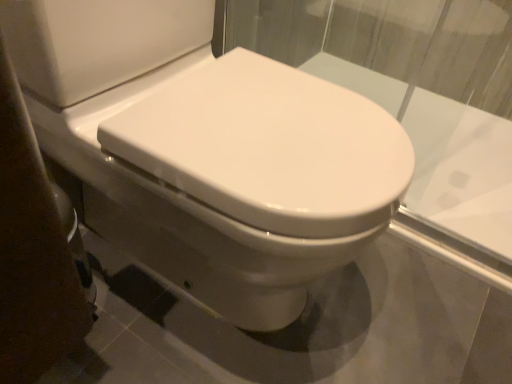
Find the location of a particular element. Image resolution: width=512 pixels, height=384 pixels. transparent glass at center is located at coordinates (413, 89).

Describe the element at coordinates (413, 89) in the screenshot. The width and height of the screenshot is (512, 384). I see `transparent glass at center` at that location.

The width and height of the screenshot is (512, 384). What do you see at coordinates (269, 155) in the screenshot? I see `white glossy bidet at center` at bounding box center [269, 155].

Find the location of a particular element. The image size is (512, 384). white glossy bidet at center is located at coordinates (269, 155).

At what (x,y) coordinates should I click in order to perform the action: click on transparent glass at center. Please return your answer as a coordinate pair (x, y). The width and height of the screenshot is (512, 384). Looking at the image, I should click on click(x=413, y=89).

Is transparent glass at center at the left side of white glossy bidet at center?

No, transparent glass at center is not to the left of white glossy bidet at center.

Considering the relative positions of transparent glass at center and white glossy bidet at center in the image provided, is transparent glass at center in front of white glossy bidet at center?

No, transparent glass at center is further to the viewer.

Does point (409, 21) lie behind point (220, 88)?

Yes, it is behind point (220, 88).

From the image's perspective, is transparent glass at center on white glossy bidet at center?

Indeed, from the image's perspective, transparent glass at center is shown above white glossy bidet at center.

From a real-world perspective, who is located higher, transparent glass at center or white glossy bidet at center?

From a 3D spatial view, white glossy bidet at center is above.

Looking at their sizes, would you say transparent glass at center is wider or thinner than white glossy bidet at center?

Considering their sizes, transparent glass at center looks slimmer than white glossy bidet at center.

Can you confirm if transparent glass at center is shorter than white glossy bidet at center?

Yes, transparent glass at center is shorter than white glossy bidet at center.

In terms of size, does transparent glass at center appear bigger or smaller than white glossy bidet at center?

Clearly, transparent glass at center is smaller in size than white glossy bidet at center.

Which is correct: transparent glass at center is inside white glossy bidet at center, or outside of it?

transparent glass at center can be found inside white glossy bidet at center.

Is transparent glass at center placed right next to white glossy bidet at center?

No.

Could you tell me if transparent glass at center is facing white glossy bidet at center?

Yes.

What's the angular difference between transparent glass at center and white glossy bidet at center's facing directions?

91 degrees.

I want to click on bidet in front of the transparent glass at center, so click(269, 155).

Can you confirm if white glossy bidet at center is positioned to the right of transparent glass at center?

Incorrect, white glossy bidet at center is not on the right side of transparent glass at center.

Between white glossy bidet at center and transparent glass at center, which one is positioned in front?

white glossy bidet at center is more forward.

Is point (328, 104) positioned behind point (500, 79)?

No, (328, 104) is closer to viewer.

From the image's perspective, between white glossy bidet at center and transparent glass at center, which one is located above?

From the image's view, transparent glass at center is above.

From a real-world perspective, is white glossy bidet at center beneath transparent glass at center?

Actually, white glossy bidet at center is physically above transparent glass at center in the real world.

In terms of width, does white glossy bidet at center look wider or thinner when compared to transparent glass at center?

Considering their sizes, white glossy bidet at center looks broader than transparent glass at center.

Considering the relative sizes of white glossy bidet at center and transparent glass at center in the image provided, is white glossy bidet at center shorter than transparent glass at center?

No.

In terms of size, does white glossy bidet at center appear bigger or smaller than transparent glass at center?

white glossy bidet at center is bigger than transparent glass at center.

Is white glossy bidet at center spatially inside transparent glass at center, or outside of it?

white glossy bidet at center is not enclosed by transparent glass at center.

Looking at this image, is white glossy bidet at center not close to transparent glass at center?

No, white glossy bidet at center is not far away from transparent glass at center.

Could you tell me if white glossy bidet at center is facing transparent glass at center?

Yes, white glossy bidet at center is facing transparent glass at center.

Find the location of a particular element. This screenshot has width=512, height=384. glass window lying above the white glossy bidet at center (from the image's perspective) is located at coordinates (413, 89).

Locate an element on the screen. bidet that is on the left side of transparent glass at center is located at coordinates (269, 155).

Find the location of `bidet below the transparent glass at center (from the image's perspective)`. bidet below the transparent glass at center (from the image's perspective) is located at coordinates (269, 155).